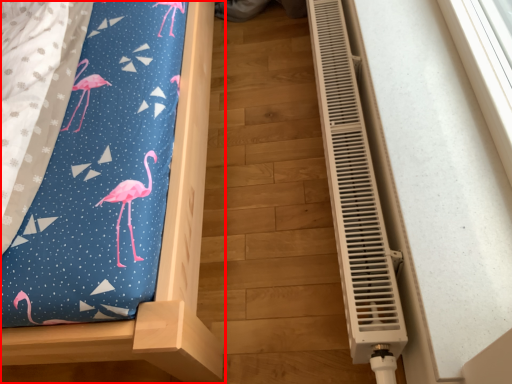
Question: In this image, where is furniture (annotated by the red box) located relative to air conditioning?

Choices:
 (A) left
 (B) right

Answer: (A)